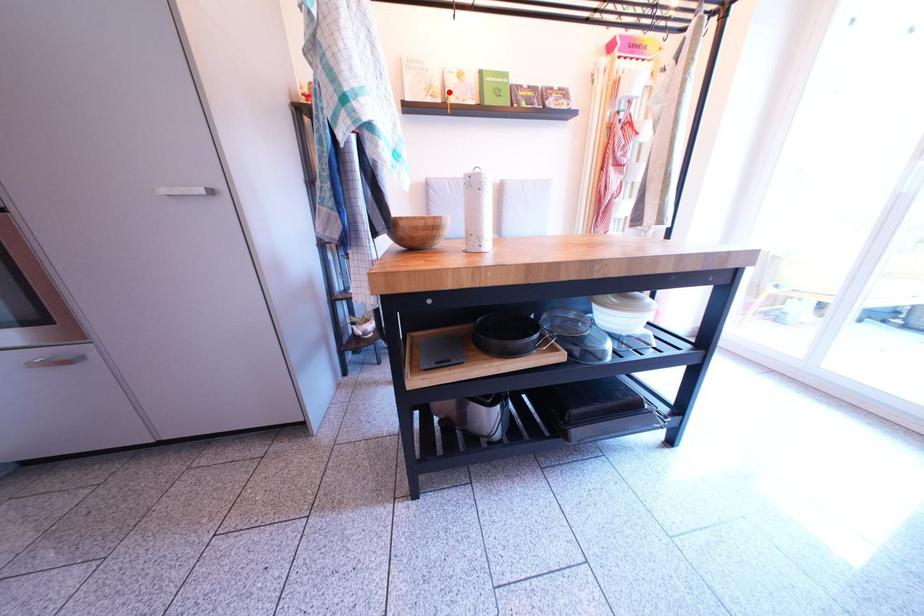
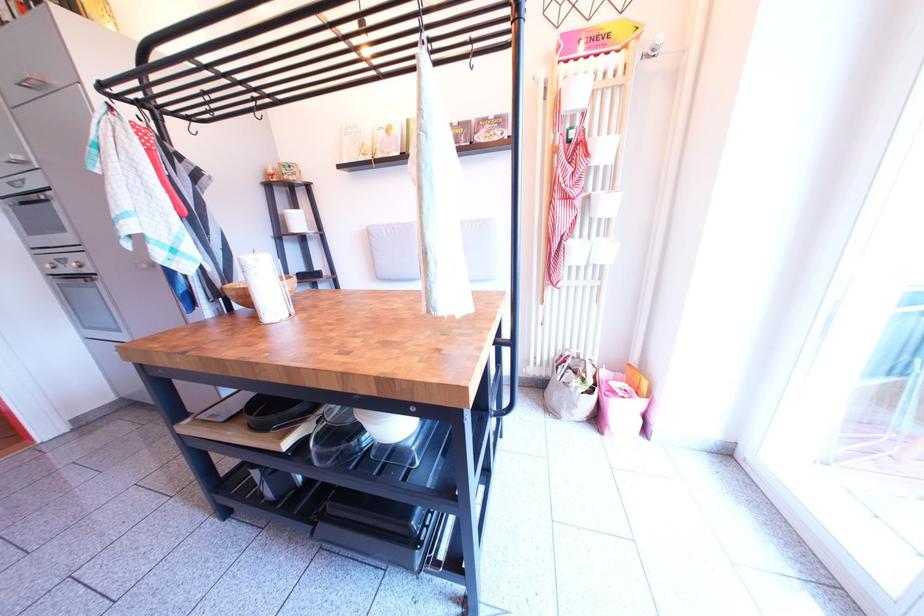
Where in the second image is the point corresponding to the highlighted location from the first image?

(380, 150)